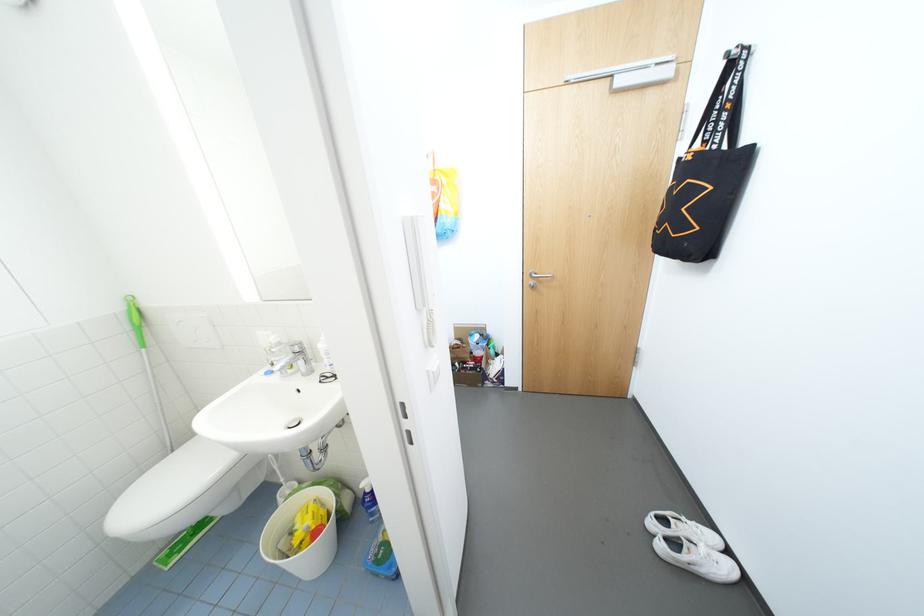
Identify the location of soap dispenser pump. (270, 334).